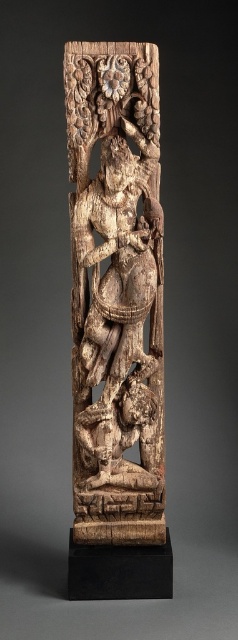
Question: Does carved wood sculpture at center have a lesser width compared to carved wood figure at lower center?

Choices:
 (A) yes
 (B) no

Answer: (B)

Question: Which object is farther from the camera taking this photo?

Choices:
 (A) carved wood sculpture at center
 (B) carved wood figure at lower center

Answer: (B)

Question: Which point is closer to the camera taking this photo?

Choices:
 (A) (113, 424)
 (B) (109, 186)

Answer: (B)

Question: Which of the following is the farthest from the observer?

Choices:
 (A) carved wood figure at lower center
 (B) carved wood sculpture at center

Answer: (A)

Question: Can you confirm if carved wood sculpture at center is smaller than carved wood figure at lower center?

Choices:
 (A) no
 (B) yes

Answer: (A)

Question: Is carved wood sculpture at center closer to the viewer compared to carved wood figure at lower center?

Choices:
 (A) yes
 (B) no

Answer: (A)